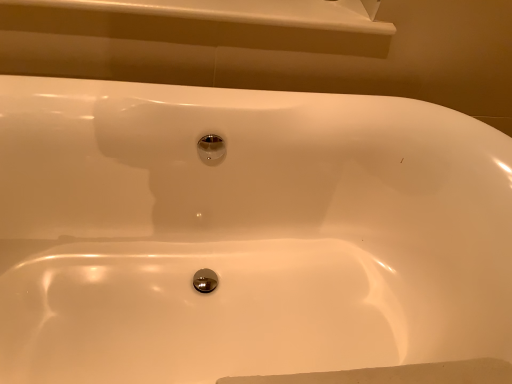
Find the location of a particular element. free location above white glossy window sill at upper center (from a real-world perspective) is located at coordinates (277, 8).